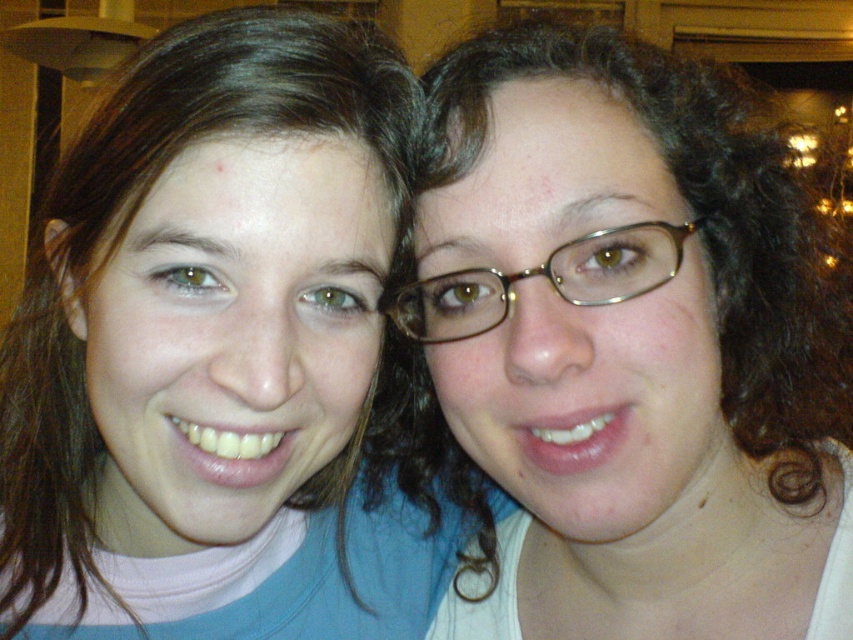
Question: Which point is farther to the camera?

Choices:
 (A) matte pink shirt at left
 (B) gold metallic glasses at center

Answer: (B)

Question: Is matte brown hair at right closer to the viewer compared to gold metallic glasses at center?

Choices:
 (A) no
 (B) yes

Answer: (B)

Question: Which point is closer to the camera?

Choices:
 (A) matte pink shirt at left
 (B) gold metallic glasses at center

Answer: (A)

Question: Which of the following is the farthest from the observer?

Choices:
 (A) matte brown hair at right
 (B) matte pink shirt at left

Answer: (B)

Question: Is the position of matte pink shirt at left less distant than that of matte brown hair at right?

Choices:
 (A) no
 (B) yes

Answer: (A)

Question: Where is matte pink shirt at left located in relation to matte brown hair at right in the image?

Choices:
 (A) right
 (B) left

Answer: (B)